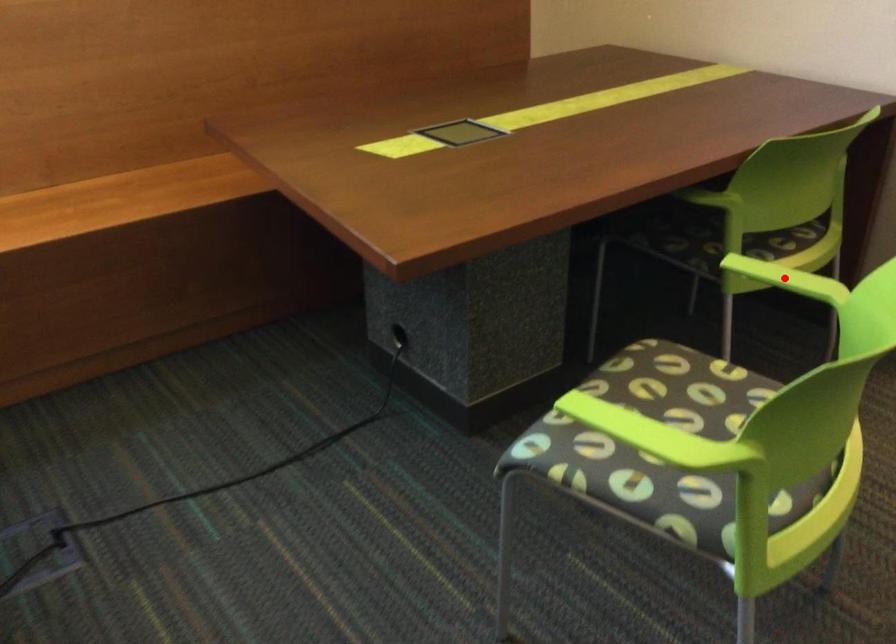
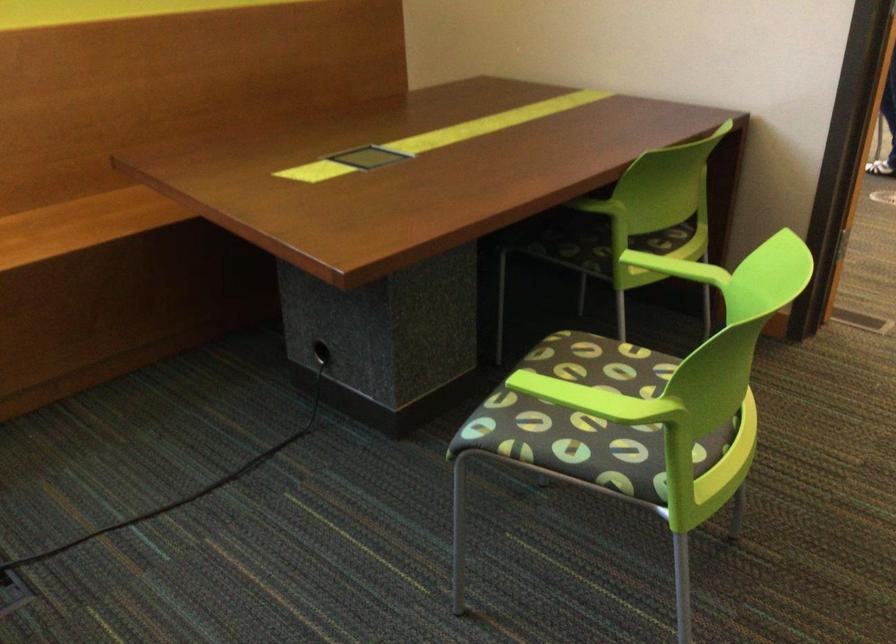
Where in the second image is the point corresponding to the highlighted location from the first image?

(676, 268)